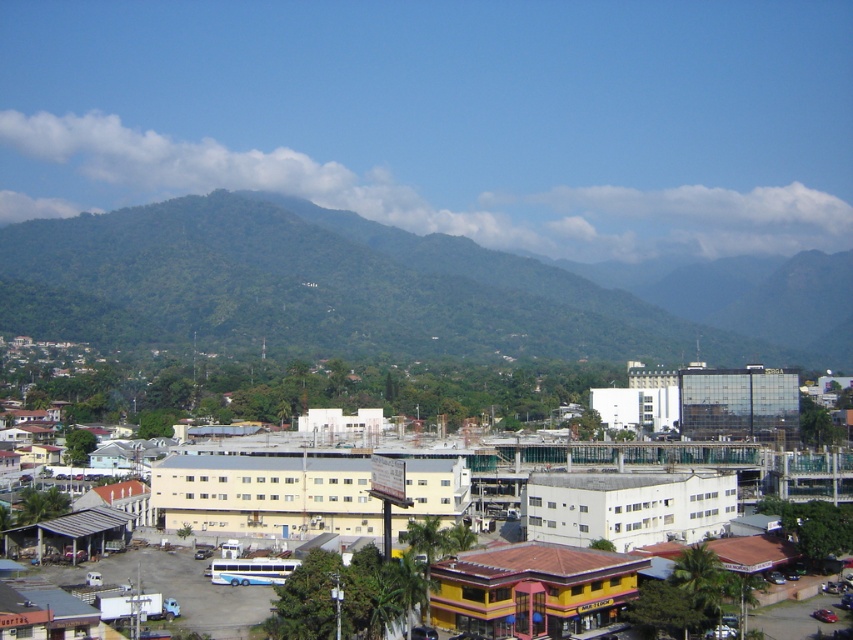
You are standing at the center of the city looking towards the green leafy mountain at center. Which direction should you face to see the mountain?

The green leafy mountain at center is located at point (399, 289), so you should face towards the center to see it.

You are standing in the city and want to take a photo of the white matte building at center and the green leafy mountain at center. Which one should you point your camera towards first if you want to capture both in one shot?

You should point your camera towards the white matte building at center first because the green leafy mountain at center is to the right of it, so capturing the building first will allow you to frame both in the same shot.